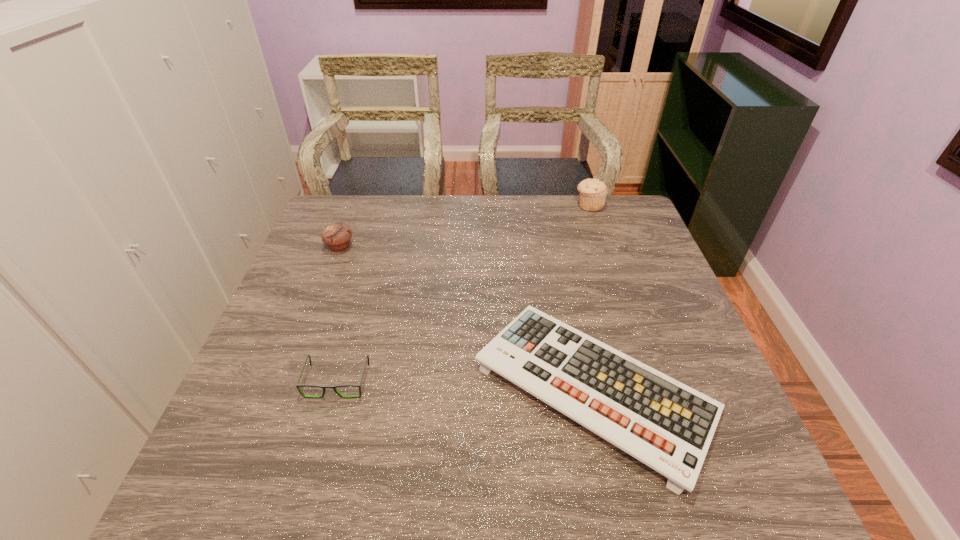
At what (x,y) coordinates should I click in order to perform the action: click on the right muffin. Please return your answer as a coordinate pair (x, y). The height and width of the screenshot is (540, 960). Looking at the image, I should click on (593, 192).

Identify the location of the taller muffin. This screenshot has width=960, height=540. (593, 192).

Image resolution: width=960 pixels, height=540 pixels. What are the coordinates of `the nearer muffin` in the screenshot? It's located at (337, 236).

Locate an element on the screen. The width and height of the screenshot is (960, 540). the third nearest object is located at coordinates (337, 236).

This screenshot has height=540, width=960. I want to click on spectacles, so click(x=298, y=385).

Where is `computer keyboard`? computer keyboard is located at coordinates (667, 425).

The image size is (960, 540). What are the coordinates of `vacant area situated on the left of the taller muffin` in the screenshot? It's located at (511, 205).

Find the location of a particular element. free region located 0.200m on the right of the second farthest object is located at coordinates (420, 246).

At what (x,y) coordinates should I click in order to perform the action: click on vacant region located 0.130m on the lens of the spectacles. Please return your answer as a coordinate pair (x, y). Looking at the image, I should click on (316, 457).

Locate an element on the screen. The height and width of the screenshot is (540, 960). vacant position located on the left of the computer keyboard is located at coordinates (360, 387).